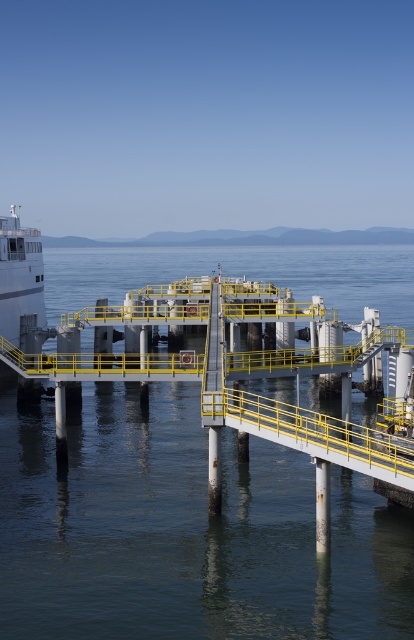
Question: Does clear blue water at center come behind white glossy ship at left?

Choices:
 (A) no
 (B) yes

Answer: (A)

Question: Which point appears closest to the camera in this image?

Choices:
 (A) (12, 243)
 (B) (370, 406)

Answer: (B)

Question: Can you confirm if clear blue water at center is wider than white glossy ship at left?

Choices:
 (A) yes
 (B) no

Answer: (A)

Question: From the image, what is the correct spatial relationship of clear blue water at center in relation to white glossy ship at left?

Choices:
 (A) left
 (B) right

Answer: (B)

Question: Which of the following is the closest to the observer?

Choices:
 (A) white glossy ship at left
 (B) clear blue water at center

Answer: (B)